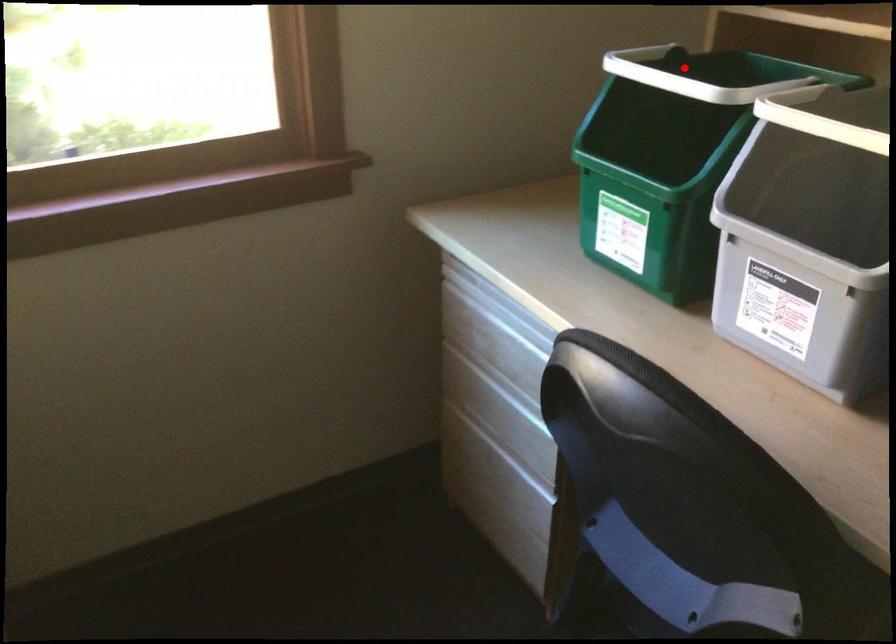
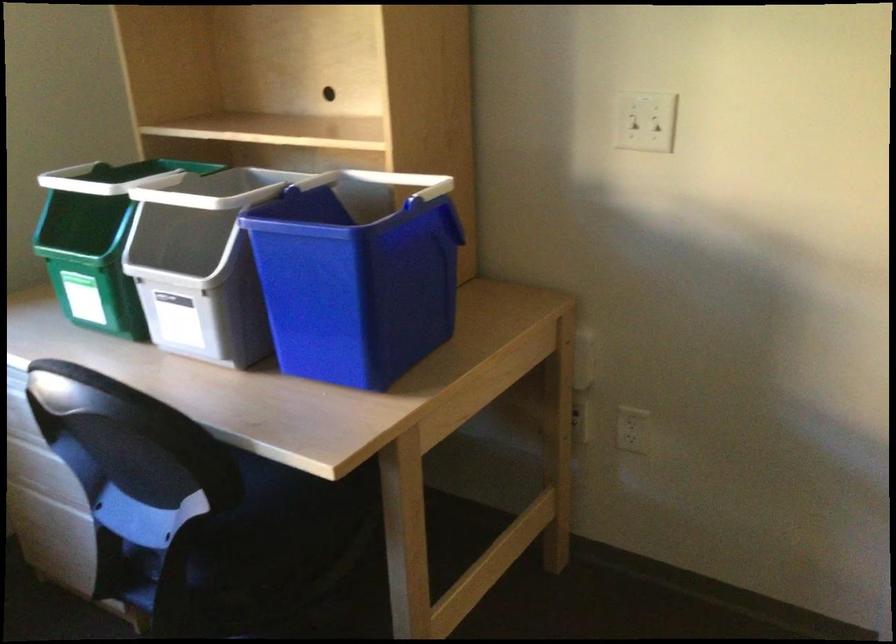
In the second image, find the point that corresponds to the highlighted location in the first image.

(116, 178)